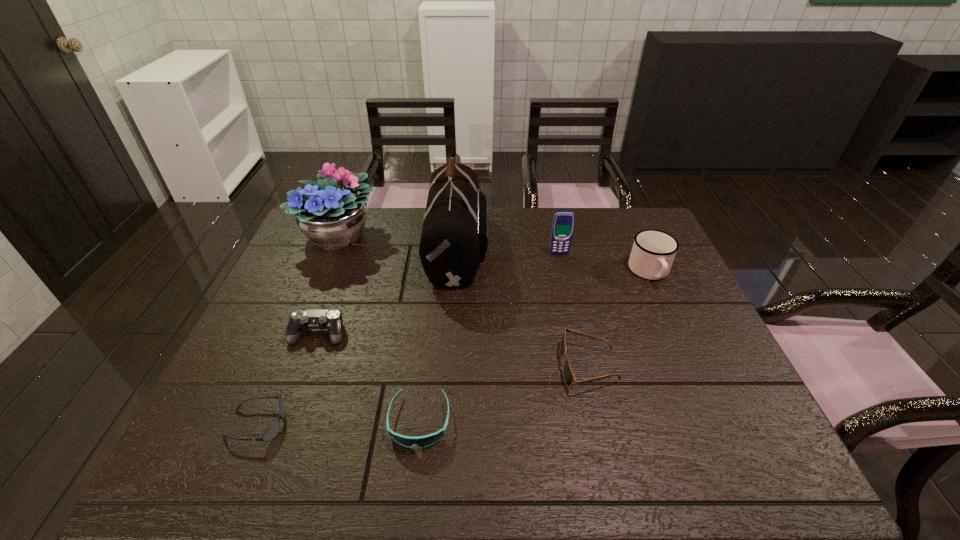
I want to click on vacant space located on the front pocket of the tallest object, so click(559, 247).

This screenshot has width=960, height=540. In order to click on blank area located 0.190m on the right of the seventh shortest object in this screenshot , I will do tap(438, 235).

Locate an element on the screen. This screenshot has width=960, height=540. vacant space located on the front-facing side of the cellular telephone is located at coordinates (564, 271).

You are a GUI agent. You are given a task and a screenshot of the screen. Output one action in this format:
    pyautogui.click(x=<x>, y=<y>)
    Task: Click on the free space located 0.190m on the side of the mug with the handle
    The image size is (960, 540).
    Given the screenshot: What is the action you would take?
    pyautogui.click(x=681, y=340)

Identify the location of free location located on the right of the control. pos(498,333).

Locate an element on the screen. Image resolution: width=960 pixels, height=540 pixels. free spot located on the frames of the rightmost sunglasses is located at coordinates (426, 366).

Locate an element on the screen. This screenshot has height=540, width=960. free space located 0.190m on the frames of the rightmost sunglasses is located at coordinates (484, 366).

I want to click on vacant area situated on the frames of the rightmost sunglasses, so click(x=488, y=366).

Where is `vacant space situated 0.060m on the front-facing side of the second sunglasses from left to right`? vacant space situated 0.060m on the front-facing side of the second sunglasses from left to right is located at coordinates (413, 481).

Identify the location of free space located on the lenses of the leftmost sunglasses. (372, 424).